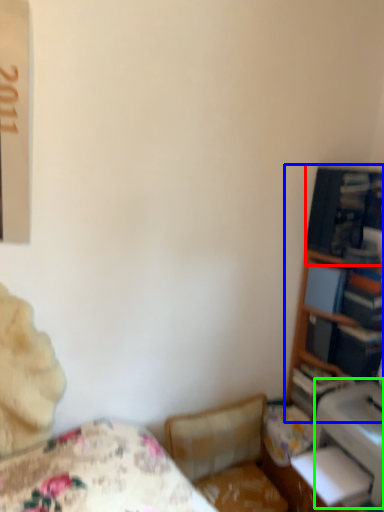
Question: Estimate the real-world distances between objects in this image. Which object is closer to shelf (highlighted by a red box), bookshelf (highlighted by a blue box) or printer (highlighted by a green box)?

Choices:
 (A) bookshelf
 (B) printer

Answer: (A)